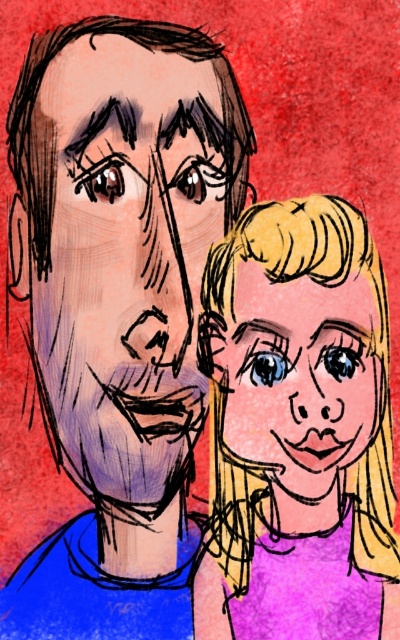
You are an artist trying to draw the scene described. You need to place the purple matte hair at right and the smooth blonde hair at center correctly. According to the scene, which object should be placed to the left side?

The purple matte hair at right should be placed to the left of the smooth blonde hair at center because the description states that the purple matte hair at right is to the left of smooth blonde hair at center.

You are an artist holding a 12 inch paintbrush. You want to paint the purple matte hair at right without moving your hand. Can you reach it?

The purple matte hair at right is 32.01 inches from viewer. Since your paintbrush is only 12 inches long, you cannot reach it without moving your hand.

You are an artist trying to paint the scene described. You want to paint the matte purple face at center first. Can you paint it without covering the smooth blonde hair at center?

The matte purple face at center is positioned over smooth blonde hair at center, so painting the matte purple face at center first would cover the smooth blonde hair at center. You should paint the smooth blonde hair at center first before painting the matte purple face at center.